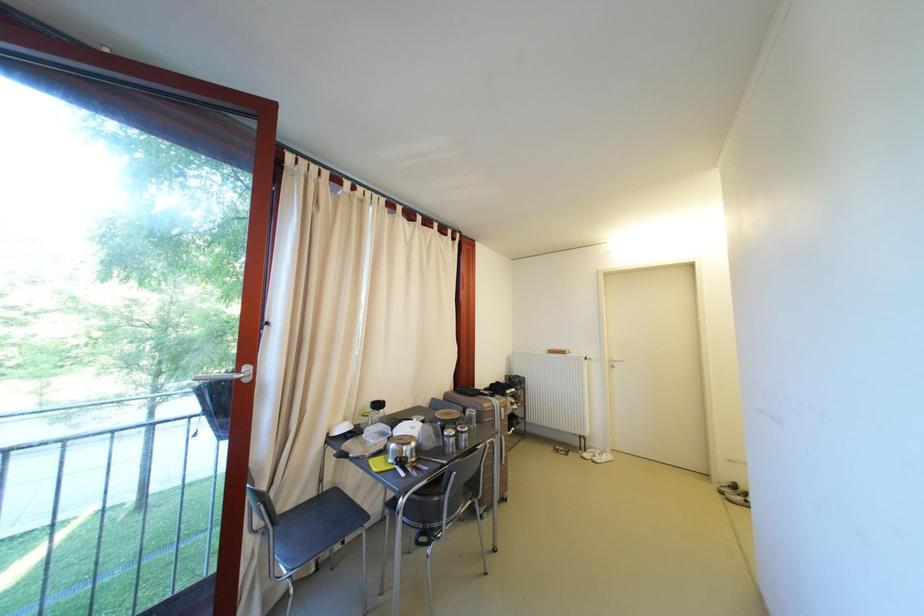
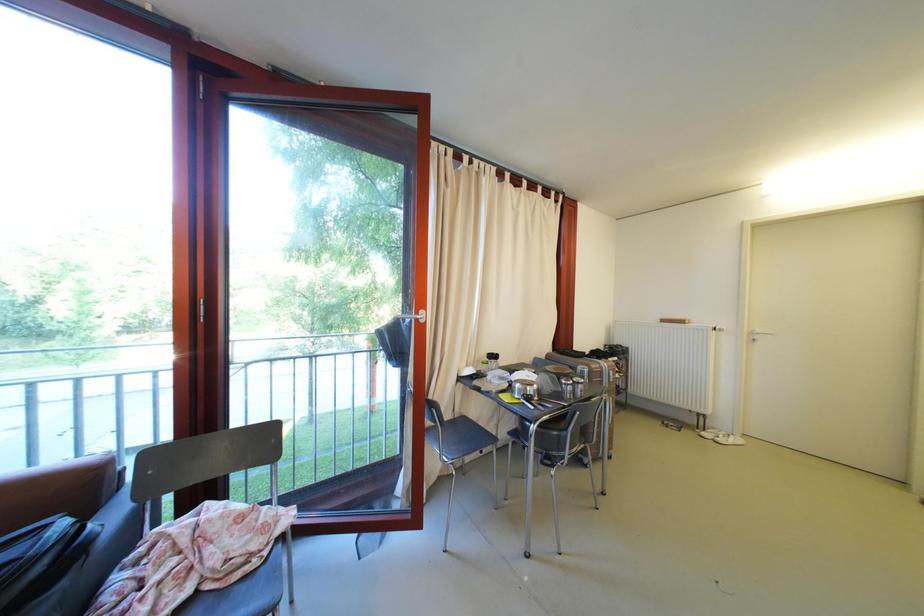
Question: The camera is either moving clockwise (left) or counter-clockwise (right) around the object. The first image is from the beginning of the video and the second image is from the end. Is the camera moving left or right when shooting the video?

Choices:
 (A) Left
 (B) Right

Answer: (B)